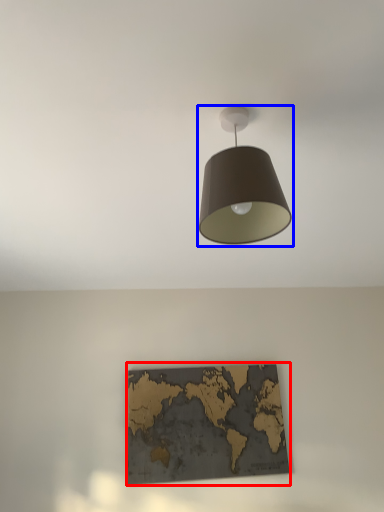
Question: Which object appears closest to the camera in this image, picture frame (highlighted by a red box) or lamp (highlighted by a blue box)?

Choices:
 (A) picture frame
 (B) lamp

Answer: (B)